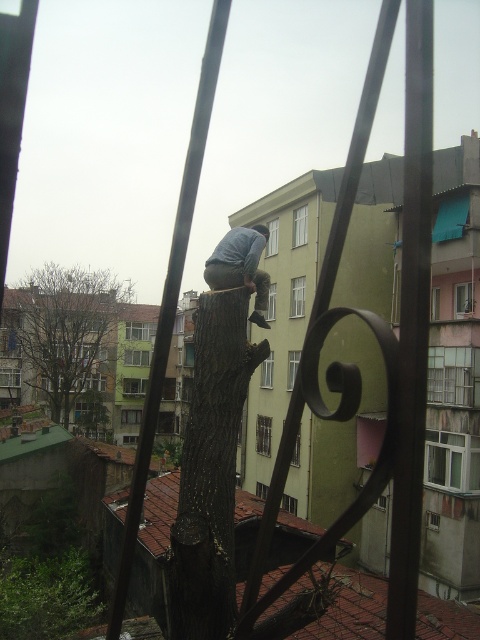
Question: Which is nearer to the brown rough tree trunk at center?

Choices:
 (A) brown leafless tree at lower left
 (B) light blue denim jeans at center

Answer: (B)

Question: Estimate the real-world distances between objects in this image. Which object is closer to the brown rough tree trunk at center?

Choices:
 (A) light blue denim jeans at center
 (B) brown leafless tree at lower left

Answer: (A)

Question: Can you confirm if brown rough tree trunk at center is smaller than brown leafless tree at lower left?

Choices:
 (A) no
 (B) yes

Answer: (B)

Question: Which of the following is the farthest from the observer?

Choices:
 (A) brown leafless tree at lower left
 (B) light blue denim jeans at center
 (C) brown rough tree trunk at center

Answer: (A)

Question: Is brown leafless tree at lower left closer to the viewer compared to light blue denim jeans at center?

Choices:
 (A) yes
 (B) no

Answer: (B)

Question: Can you confirm if brown rough tree trunk at center is thinner than brown leafless tree at lower left?

Choices:
 (A) no
 (B) yes

Answer: (B)